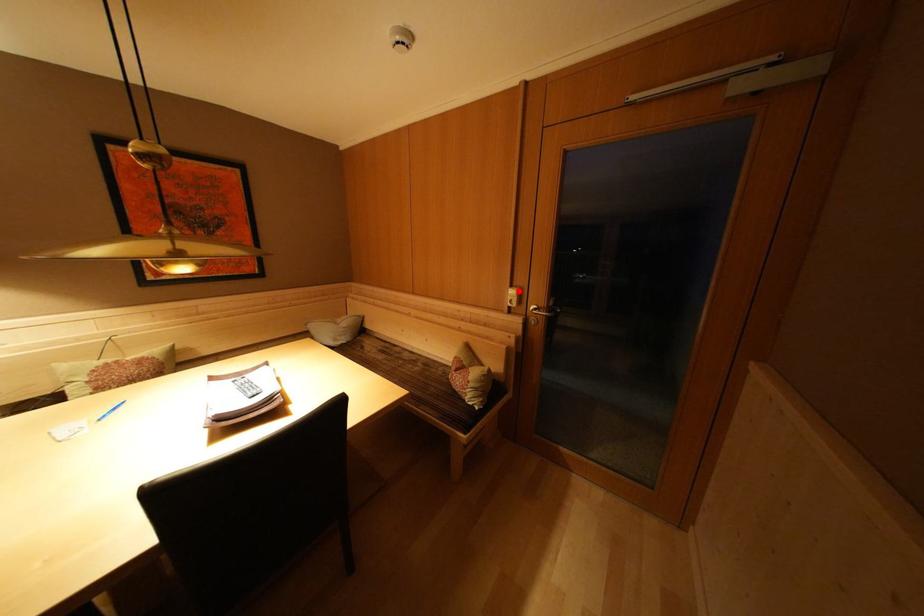
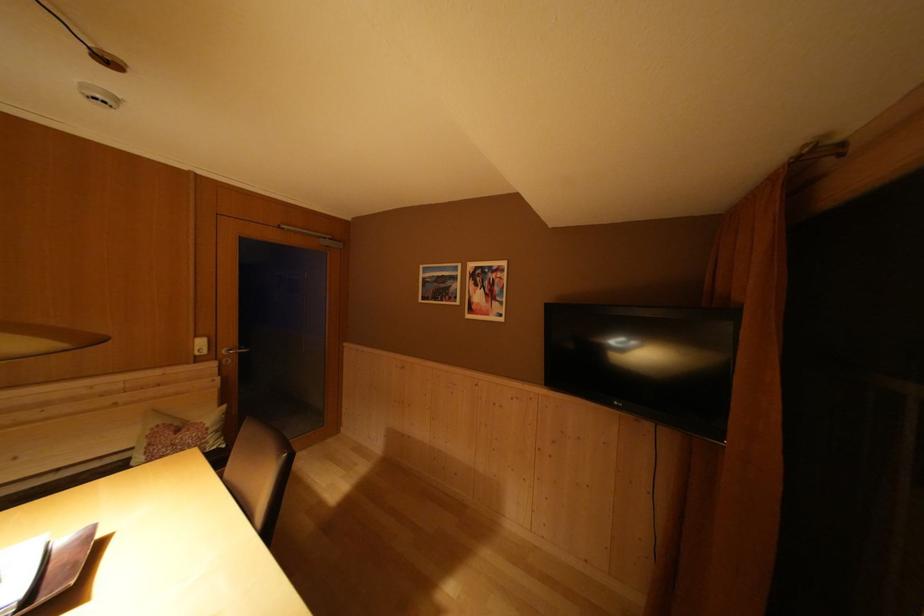
Where in the second image is the point corresponding to the highlighted location from the first image?

(203, 342)